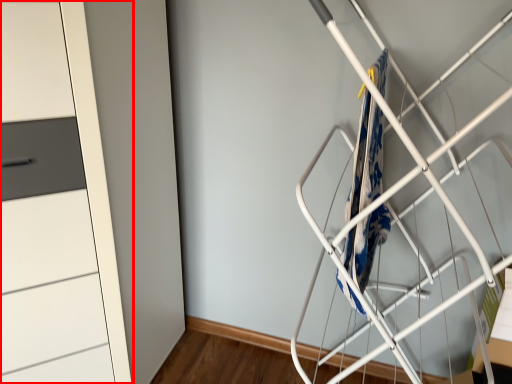
Question: From the image's perspective, where is cupboard (annotated by the red box) located relative to blanket?

Choices:
 (A) above
 (B) below

Answer: (B)